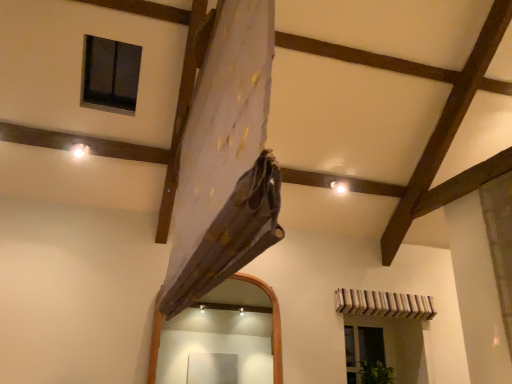
The image size is (512, 384). What do you see at coordinates (367, 343) in the screenshot?
I see `clear glass window at lower right` at bounding box center [367, 343].

What is the approximate height of clear glass window at lower right?

28.64 inches.

The height and width of the screenshot is (384, 512). Find the location of `clear glass window at lower right`. clear glass window at lower right is located at coordinates (367, 343).

Measure the distance between clear glass window at lower right and camera.

clear glass window at lower right and camera are 4.61 meters apart.

I want to click on clear glass window at lower right, so click(x=367, y=343).